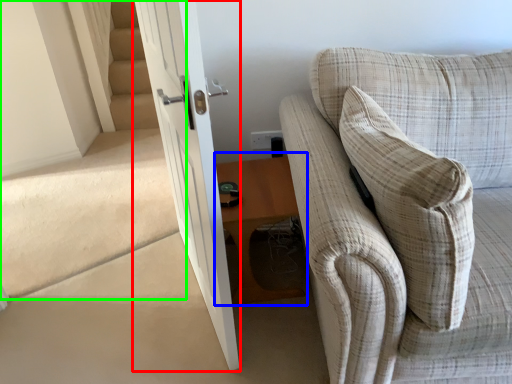
Question: Which object is the farthest from door (highlighted by a red box)? Choose among these: table (highlighted by a blue box) or stairwell (highlighted by a green box).

Choices:
 (A) table
 (B) stairwell

Answer: (B)